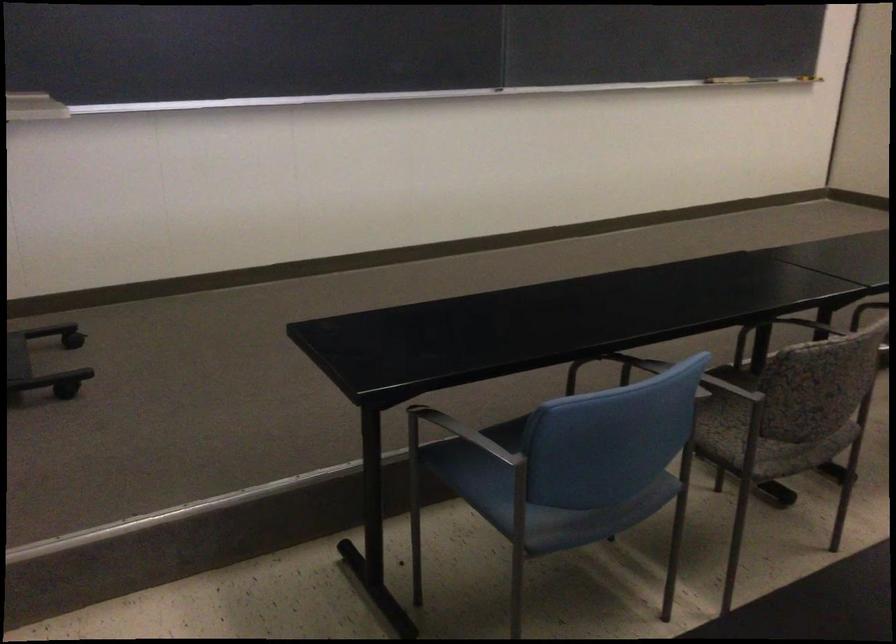
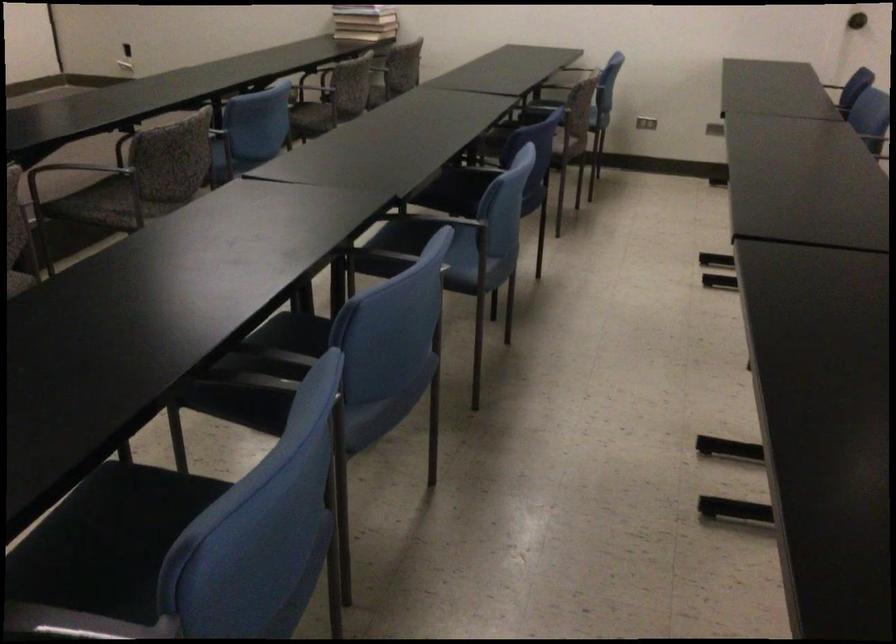
Question: The first image is from the beginning of the video and the second image is from the end. How did the camera likely rotate when shooting the video?

Choices:
 (A) Left
 (B) Right
 (C) Up
 (D) Down

Answer: (B)